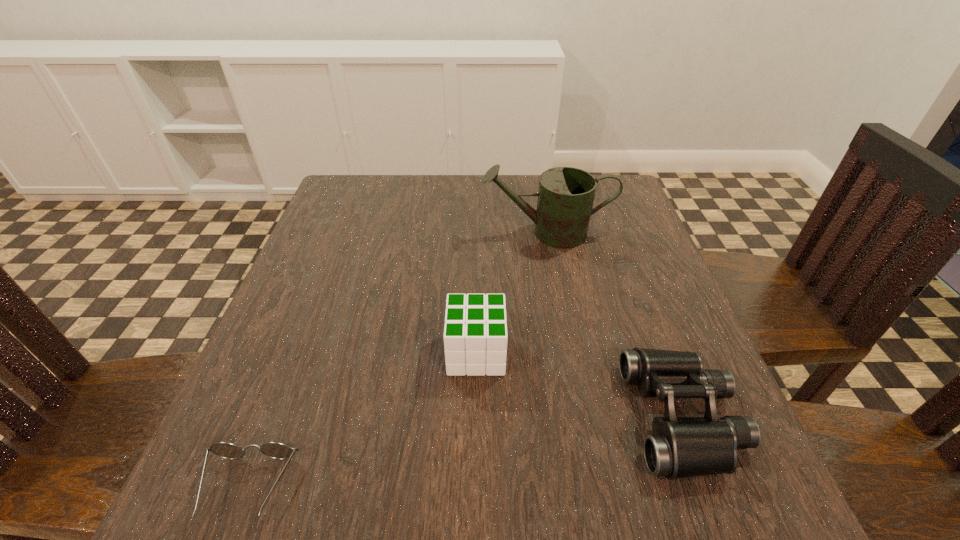
Locate an element on the screen. The width and height of the screenshot is (960, 540). object identified as the second closest to the third tallest object is located at coordinates pyautogui.click(x=566, y=195).

Locate an element on the screen. This screenshot has width=960, height=540. free space that satisfies the following two spatial constraints: 1. with the spout on the farthest object; 2. on the front-facing side of the spectacles is located at coordinates (594, 487).

Locate an element on the screen. free region that satisfies the following two spatial constraints: 1. with the spout on the watering can; 2. on the front-facing side of the shortest object is located at coordinates (594, 487).

Identify the location of vacant region that satisfies the following two spatial constraints: 1. on the red face of the cube; 2. on the front-facing side of the leftmost object. (475, 487).

Find the location of a particular element. This screenshot has width=960, height=540. vacant point that satisfies the following two spatial constraints: 1. on the front-facing side of the second shortest object; 2. on the front-facing side of the leftmost object is located at coordinates (708, 487).

Identify the location of vacant space that satisfies the following two spatial constraints: 1. with the spout on the tallest object; 2. on the front-facing side of the leftmost object. (594, 487).

Locate an element on the screen. The width and height of the screenshot is (960, 540). free space that satisfies the following two spatial constraints: 1. with the spout on the farthest object; 2. on the front-facing side of the spectacles is located at coordinates (594, 487).